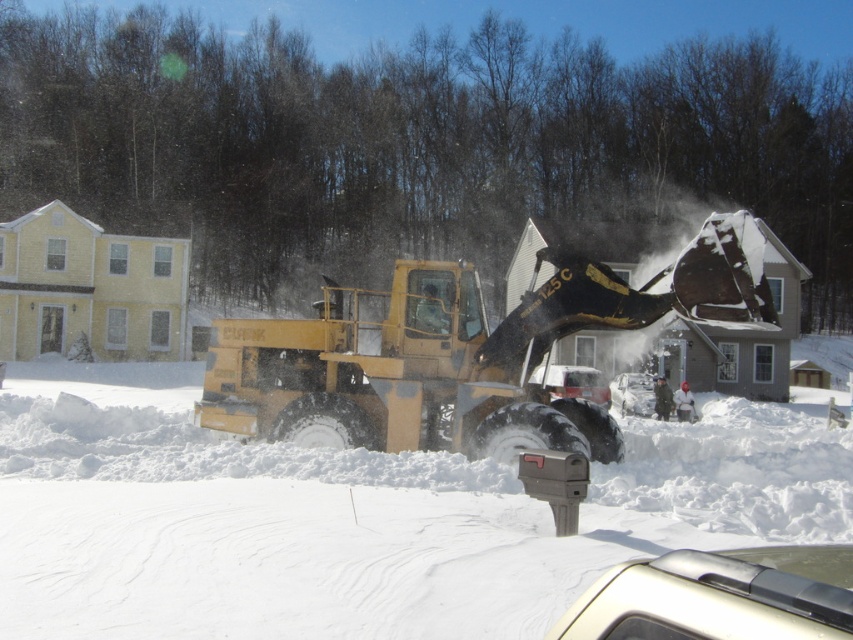
You are a delivery driver who needs to park your truck near the driveway. The white fluffy snow at center and the metallic silver car at center are in the way. Which one should you move first to make space?

The white fluffy snow at center has a larger size compared to metallic silver car at center, so you should move the white fluffy snow at center first to make space.

You are inside a car parked on the snowy driveway. You notice a point marked at coordinates (x=461, y=353). What object is located at that point?

The point at coordinates (x=461, y=353) corresponds to the yellow rubber plow at center.

You are a snowplow operator who needs to clear a driveway blocked by two objects. You see the yellow rubber plow at center and the metallic silver car at center. Which object should you move first based on their sizes?

The yellow rubber plow at center is bigger than the metallic silver car at center, so you should move the yellow rubber plow at center first because it takes up more space and needs to be cleared first to make room for the smaller metallic silver car at center.